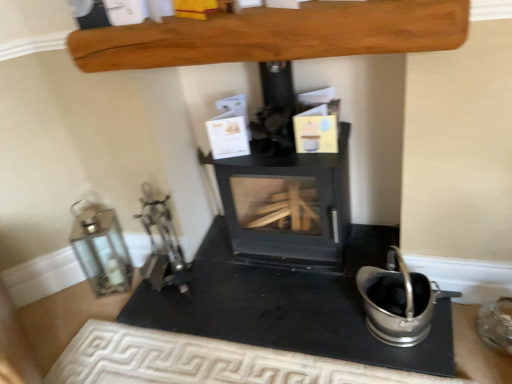
Locate an element on the screen. The width and height of the screenshot is (512, 384). vacant area situated to the left side of silver metallic lantern at left, acting as the 1th appliance starting from the left is located at coordinates (70, 306).